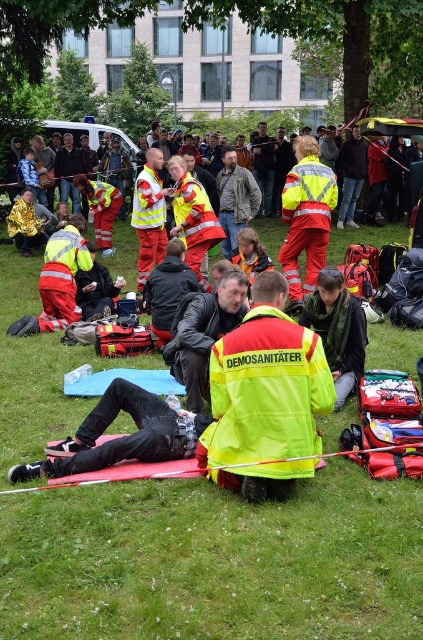
You are a participant in the demonstration and need to place an object on the ground. Which object should you place it on top of, the green grass at center or the leather jacket at center?

You should place the object on top of the leather jacket at center because the green grass at center is located below it.

You are a photographer positioned at the camera location. You want to capture a closeup shot of the point at coordinates point (36,600) and point (247,170). Which point will appear larger in the photo?

Point (36,600) is closer to the camera than point (247,170), so it will appear larger in the photo.